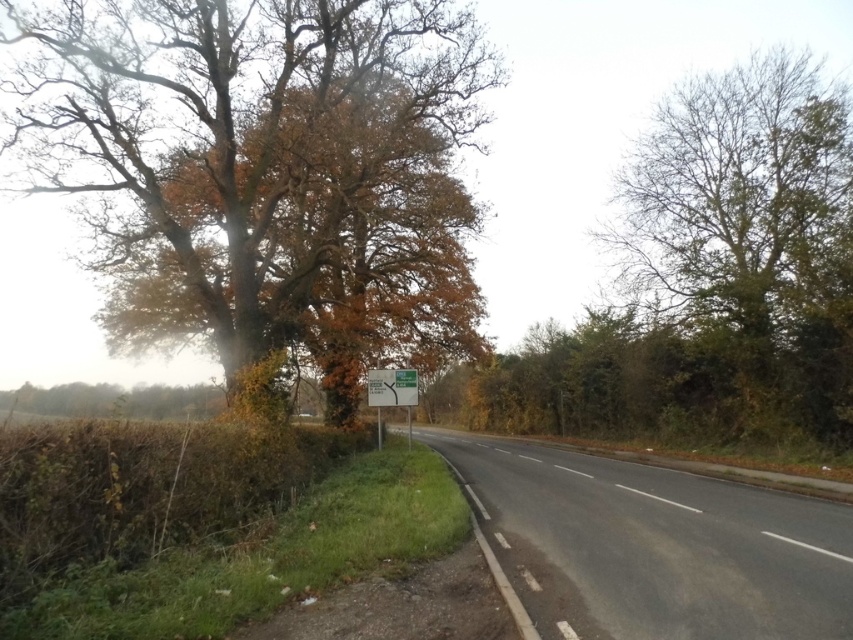
Question: Estimate the real-world distances between objects in this image. Which object is closer to the white plastic sign at center?

Choices:
 (A) bare branches tree at right
 (B) black asphalt highway at center

Answer: (B)

Question: Which object is closer to the camera taking this photo?

Choices:
 (A) green plastic sign at center
 (B) black asphalt highway at center
 (C) autumn leaves wood at left

Answer: (B)

Question: Does autumn leaves wood at left appear on the left side of white plastic sign at center?

Choices:
 (A) yes
 (B) no

Answer: (A)

Question: Can you confirm if white plastic sign at center is smaller than green plastic sign at center?

Choices:
 (A) yes
 (B) no

Answer: (A)

Question: In this image, where is autumn leaves wood at left located relative to white plastic sign at center?

Choices:
 (A) above
 (B) below

Answer: (A)

Question: Which of these objects is positioned farthest from the bare branches tree at right?

Choices:
 (A) green plastic sign at center
 (B) white plastic sign at center

Answer: (B)